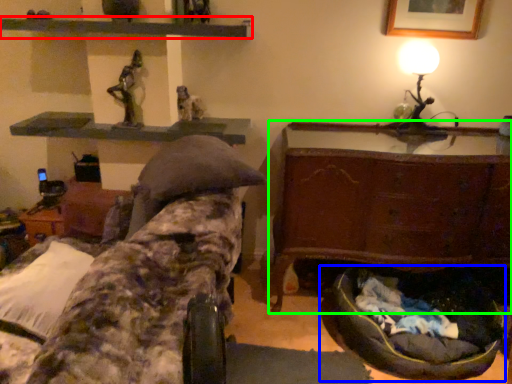
Question: Estimate the real-world distances between objects in this image. Which object is farther from shelf (highlighted by a red box), bean bag chair (highlighted by a blue box) or furniture (highlighted by a green box)?

Choices:
 (A) bean bag chair
 (B) furniture

Answer: (A)